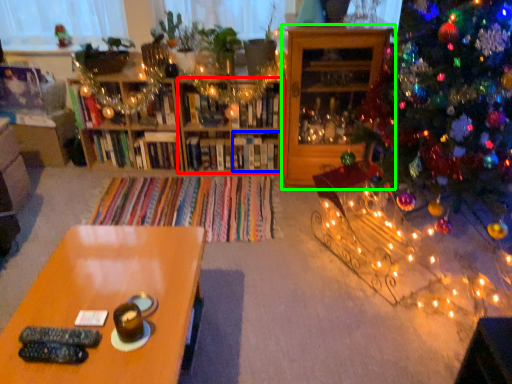
Question: Which is farther away from shelf (highlighted by a red box)? shelf (highlighted by a blue box) or shelf (highlighted by a green box)?

Choices:
 (A) shelf
 (B) shelf

Answer: (B)